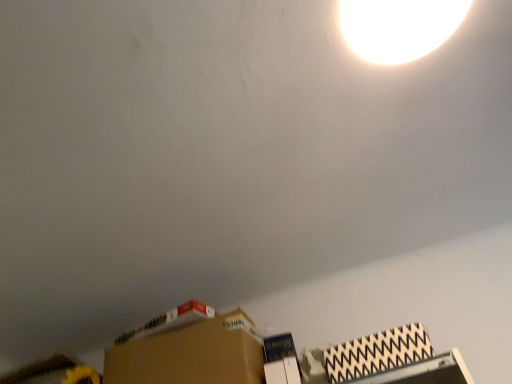
Find the location of a particular element. patterned cardboard box at lower right, the second cardboard box positioned from the left is located at coordinates (377, 353).

How much space does brown cardboard box at lower center, arranged as the second cardboard box when viewed from the front, occupy vertically?

brown cardboard box at lower center, arranged as the second cardboard box when viewed from the front, is 28.81 centimeters in height.

In order to face brown cardboard box at lower center, arranged as the second cardboard box when viewed from the front, should I rotate leftwards or rightwards?

It's best to rotate left around 7.946 degrees.

Locate an element on the screen. This screenshot has width=512, height=384. white glossy lampshade at upper center is located at coordinates pos(398,27).

Is white glossy lampshade at upper center to the left of brown cardboard box at lower center, marked as the second cardboard box in a right-to-left arrangement, from the viewer's perspective?

No.

Between white glossy lampshade at upper center and brown cardboard box at lower center, placed as the first cardboard box when sorted from back to front, which one is positioned behind?

brown cardboard box at lower center, placed as the first cardboard box when sorted from back to front, is further from the camera.

Does white glossy lampshade at upper center touch brown cardboard box at lower center, the 1th cardboard box in the left-to-right sequence?

No, white glossy lampshade at upper center is not touching brown cardboard box at lower center, the 1th cardboard box in the left-to-right sequence.

Considering the positions of point (359, 16) and point (223, 315), is point (359, 16) closer or farther from the camera than point (223, 315)?

Point (359, 16).

How much distance is there between patterned cardboard box at lower right, the second cardboard box positioned from the left, and white glossy lampshade at upper center?

patterned cardboard box at lower right, the second cardboard box positioned from the left, and white glossy lampshade at upper center are 33.54 inches apart.

From the picture: From the image's perspective, is patterned cardboard box at lower right, positioned as the 2th cardboard box in back-to-front order, above white glossy lampshade at upper center?

Actually, patterned cardboard box at lower right, positioned as the 2th cardboard box in back-to-front order, appears below white glossy lampshade at upper center in the image.

Can you tell me how much patterned cardboard box at lower right, the 1th cardboard box from the right, and white glossy lampshade at upper center differ in facing direction?

The angle between the facing direction of patterned cardboard box at lower right, the 1th cardboard box from the right, and the facing direction of white glossy lampshade at upper center is 89.5 degrees.

Would you say white glossy lampshade at upper center is part of patterned cardboard box at lower right, the 1th cardboard box from the right,'s contents?

That's incorrect, white glossy lampshade at upper center is not inside patterned cardboard box at lower right, the 1th cardboard box from the right.

This screenshot has height=384, width=512. I want to click on cardboard box that is the 1st one when counting backward from the white glossy lampshade at upper center, so click(377, 353).

Considering the relative sizes of white glossy lampshade at upper center and patterned cardboard box at lower right, positioned as the 2th cardboard box in back-to-front order, in the image provided, is white glossy lampshade at upper center thinner than patterned cardboard box at lower right, positioned as the 2th cardboard box in back-to-front order,?

No, white glossy lampshade at upper center is not thinner than patterned cardboard box at lower right, positioned as the 2th cardboard box in back-to-front order.

Is patterned cardboard box at lower right, the second cardboard box positioned from the left, inside white glossy lampshade at upper center?

No, patterned cardboard box at lower right, the second cardboard box positioned from the left, is not surrounded by white glossy lampshade at upper center.

How different are the orientations of white glossy lampshade at upper center and patterned cardboard box at lower right, the second cardboard box positioned from the left, in degrees?

There is a 89.5-degree angle between the facing directions of white glossy lampshade at upper center and patterned cardboard box at lower right, the second cardboard box positioned from the left.

Is patterned cardboard box at lower right, the 1th cardboard box from the right, facing towards brown cardboard box at lower center, marked as the second cardboard box in a right-to-left arrangement?

No, patterned cardboard box at lower right, the 1th cardboard box from the right, is not turned towards brown cardboard box at lower center, marked as the second cardboard box in a right-to-left arrangement.

Which object is further away from the camera, patterned cardboard box at lower right, positioned as the 2th cardboard box in back-to-front order, or brown cardboard box at lower center, the 1th cardboard box in the left-to-right sequence?

brown cardboard box at lower center, the 1th cardboard box in the left-to-right sequence.

From the image's perspective, is patterned cardboard box at lower right, the second cardboard box positioned from the left, above or below brown cardboard box at lower center, arranged as the second cardboard box when viewed from the front?

patterned cardboard box at lower right, the second cardboard box positioned from the left, is above brown cardboard box at lower center, arranged as the second cardboard box when viewed from the front.

In the image, is brown cardboard box at lower center, the 1th cardboard box in the left-to-right sequence, positioned in front of or behind white glossy lampshade at upper center?

Clearly, brown cardboard box at lower center, the 1th cardboard box in the left-to-right sequence, is behind white glossy lampshade at upper center.

Are brown cardboard box at lower center, arranged as the second cardboard box when viewed from the front, and white glossy lampshade at upper center beside each other?

No, brown cardboard box at lower center, arranged as the second cardboard box when viewed from the front, is not in contact with white glossy lampshade at upper center.

Is brown cardboard box at lower center, arranged as the second cardboard box when viewed from the front, oriented towards white glossy lampshade at upper center?

No, brown cardboard box at lower center, arranged as the second cardboard box when viewed from the front, is not aimed at white glossy lampshade at upper center.

Is brown cardboard box at lower center, the 1th cardboard box in the left-to-right sequence, not within white glossy lampshade at upper center?

That's correct, brown cardboard box at lower center, the 1th cardboard box in the left-to-right sequence, is outside of white glossy lampshade at upper center.

Which is less distant, (202, 378) or (409, 325)?

The point (202, 378) is more forward.

From a real-world perspective, is brown cardboard box at lower center, the 1th cardboard box in the left-to-right sequence, over patterned cardboard box at lower right, positioned as the 2th cardboard box in back-to-front order?

Yes.

Would you consider brown cardboard box at lower center, placed as the first cardboard box when sorted from back to front, to be distant from patterned cardboard box at lower right, the second cardboard box positioned from the left?

No, brown cardboard box at lower center, placed as the first cardboard box when sorted from back to front, is not far from patterned cardboard box at lower right, the second cardboard box positioned from the left.

Would you say patterned cardboard box at lower right, the second cardboard box positioned from the left, is part of brown cardboard box at lower center, the 1th cardboard box in the left-to-right sequence,'s contents?

No, patterned cardboard box at lower right, the second cardboard box positioned from the left, is not a part of brown cardboard box at lower center, the 1th cardboard box in the left-to-right sequence.

Identify the location of cardboard box that is the 2nd object located behind the white glossy lampshade at upper center. (191, 352).

In the image, there is a patterned cardboard box at lower right, positioned as the 2th cardboard box in back-to-front order. At what (x,y) coordinates should I click in order to perform the action: click on lamp above it (from the image's perspective). Please return your answer as a coordinate pair (x, y). Looking at the image, I should click on (398, 27).

Looking at the image, which one is located closer to white glossy lampshade at upper center, patterned cardboard box at lower right, the second cardboard box positioned from the left, or brown cardboard box at lower center, placed as the first cardboard box when sorted from back to front?

patterned cardboard box at lower right, the second cardboard box positioned from the left, is closer to white glossy lampshade at upper center.

Based on their spatial positions, is white glossy lampshade at upper center or patterned cardboard box at lower right, the 1th cardboard box from the right, further from brown cardboard box at lower center, marked as the second cardboard box in a right-to-left arrangement?

white glossy lampshade at upper center lies further to brown cardboard box at lower center, marked as the second cardboard box in a right-to-left arrangement, than the other object.

When comparing their distances from patterned cardboard box at lower right, positioned as the 2th cardboard box in back-to-front order, does white glossy lampshade at upper center or brown cardboard box at lower center, arranged as the second cardboard box when viewed from the front, seem closer?

Among the two, brown cardboard box at lower center, arranged as the second cardboard box when viewed from the front, is located nearer to patterned cardboard box at lower right, positioned as the 2th cardboard box in back-to-front order.

Based on their spatial positions, is brown cardboard box at lower center, marked as the second cardboard box in a right-to-left arrangement, or patterned cardboard box at lower right, the second cardboard box positioned from the left, closer to white glossy lampshade at upper center?

patterned cardboard box at lower right, the second cardboard box positioned from the left.

Considering their positions, is patterned cardboard box at lower right, the 1th cardboard box positioned from the front, positioned further to brown cardboard box at lower center, marked as the second cardboard box in a right-to-left arrangement, than white glossy lampshade at upper center?

white glossy lampshade at upper center is positioned further to the anchor brown cardboard box at lower center, marked as the second cardboard box in a right-to-left arrangement.

Estimate the real-world distances between objects in this image. Which object is further from patterned cardboard box at lower right, positioned as the 2th cardboard box in back-to-front order, brown cardboard box at lower center, marked as the second cardboard box in a right-to-left arrangement, or white glossy lampshade at upper center?

white glossy lampshade at upper center lies further to patterned cardboard box at lower right, positioned as the 2th cardboard box in back-to-front order, than the other object.

You are a GUI agent. You are given a task and a screenshot of the screen. Output one action in this format:
    pyautogui.click(x=<x>, y=<y>)
    Task: Click on the cardboard box between white glossy lampshade at upper center and brown cardboard box at lower center, the 1th cardboard box in the left-to-right sequence, in the vertical direction
    
    Given the screenshot: What is the action you would take?
    pyautogui.click(x=377, y=353)